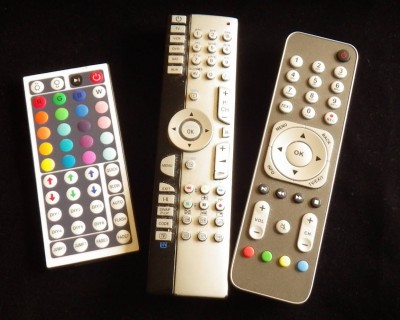
You are a GUI agent. You are given a task and a screenshot of the screen. Output one action in this format:
    pyautogui.click(x=<x>, y=<y>)
    Task: Click on the black and white remote
    This screenshot has width=400, height=320.
    Given the screenshot: What is the action you would take?
    pyautogui.click(x=205, y=271), pyautogui.click(x=155, y=275)